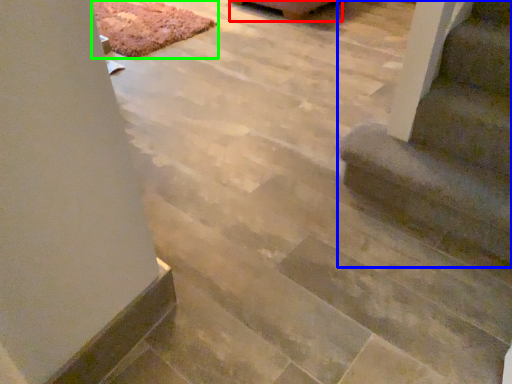
Question: Which object is positioned farthest from furniture (highlighted by a red box)? Select from stairs (highlighted by a blue box) and mat (highlighted by a green box).

Choices:
 (A) stairs
 (B) mat

Answer: (A)